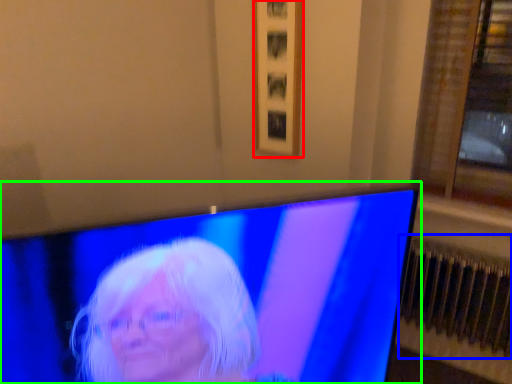
Question: Which object is the closest to the picture frame (highlighted by a red box)? Choose among these: radiator (highlighted by a blue box) or television (highlighted by a green box).

Choices:
 (A) radiator
 (B) television

Answer: (A)